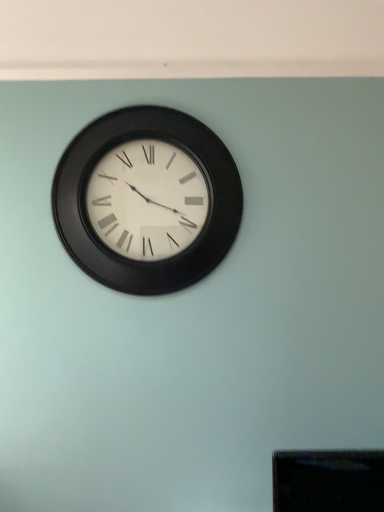
Locate an element on the screen. The width and height of the screenshot is (384, 512). matte black clock at center is located at coordinates click(147, 200).

This screenshot has width=384, height=512. What do you see at coordinates (147, 200) in the screenshot? I see `matte black clock at center` at bounding box center [147, 200].

Where is `matte black clock at center`? Image resolution: width=384 pixels, height=512 pixels. matte black clock at center is located at coordinates (147, 200).